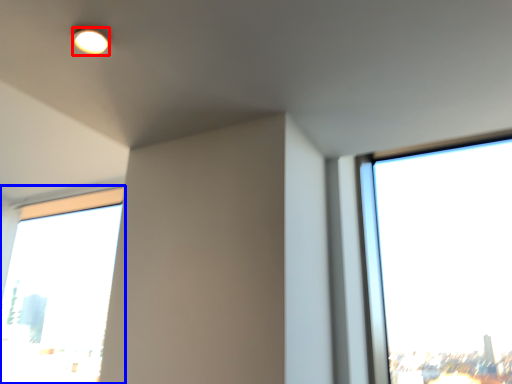
Question: Which object is closer to the camera taking this photo, lighting (highlighted by a red box) or window (highlighted by a blue box)?

Choices:
 (A) lighting
 (B) window

Answer: (A)